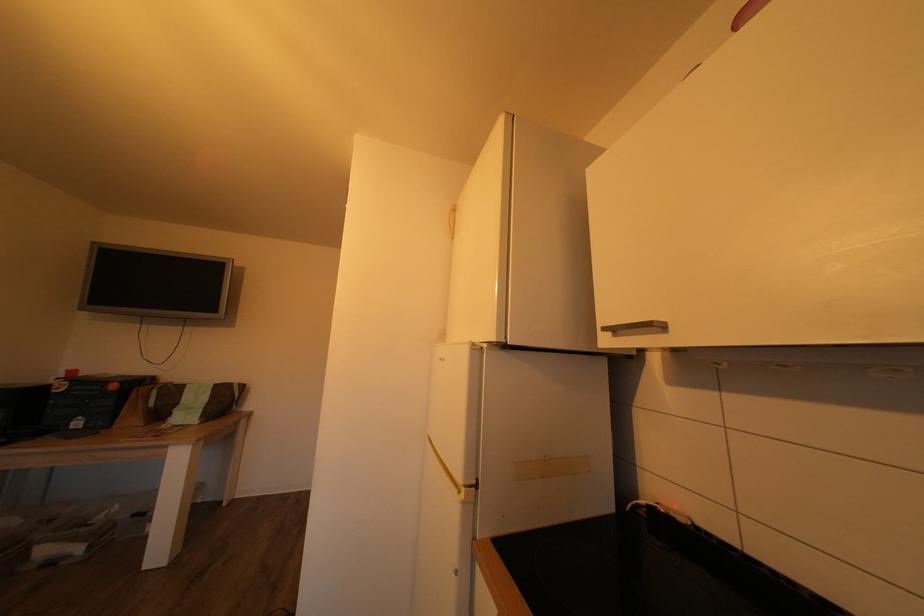
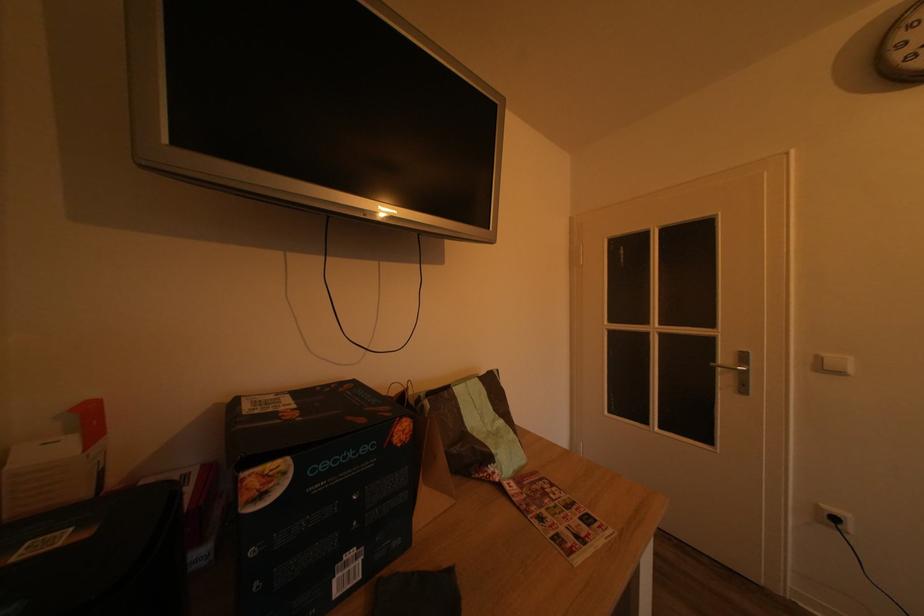
In a continuous first-person perspective shot, in which direction is the camera moving?

The cameraman moved toward left, forward.